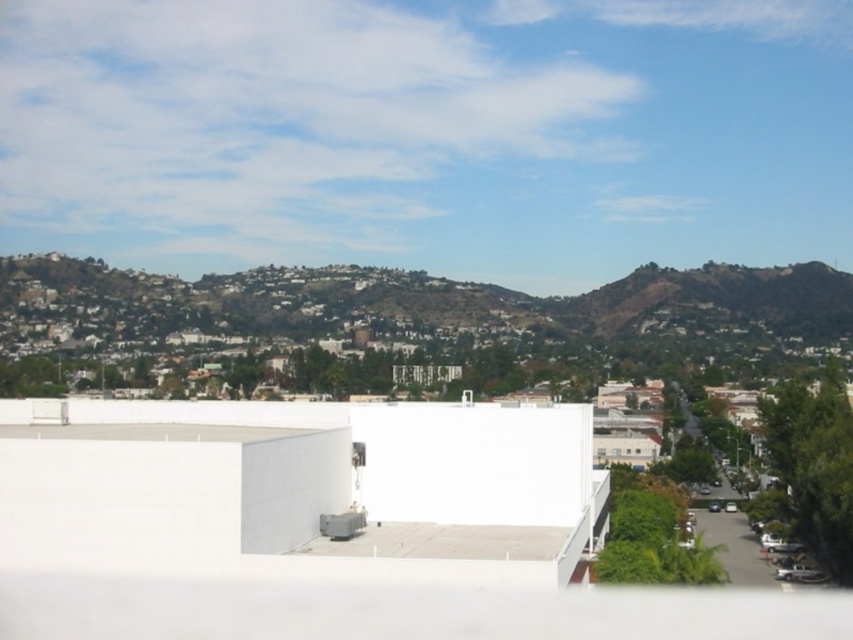
Question: Among these points, which one is nearest to the camera?

Choices:
 (A) (746, 276)
 (B) (175, 433)

Answer: (B)

Question: Is white smooth building at center closer to the viewer compared to green grassy hillside at upper center?

Choices:
 (A) yes
 (B) no

Answer: (A)

Question: Is white smooth building at center above green grassy hillside at upper center?

Choices:
 (A) yes
 (B) no

Answer: (B)

Question: Is white smooth building at center wider than green grassy hillside at upper center?

Choices:
 (A) no
 (B) yes

Answer: (A)

Question: Which of the following is the farthest from the observer?

Choices:
 (A) (485, 323)
 (B) (352, 419)

Answer: (A)